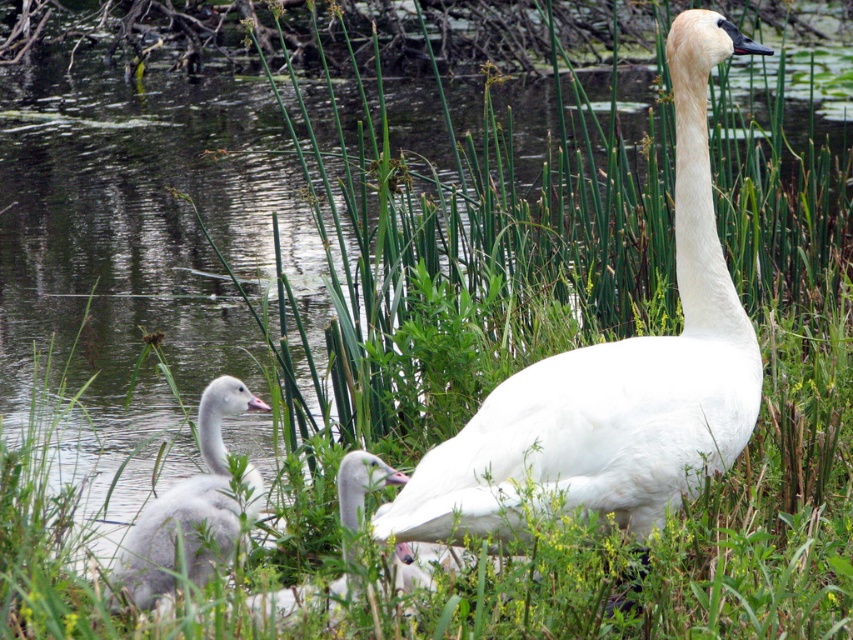
You are a wildlife photographer trying to capture a photo of the gray downy swan at lower left and the white matte duckling at center. You want to ensure both subjects are in focus. Since depth of field is limited, you need to adjust your camera settings based on their sizes. Which subject should you focus on to ensure the larger one is sharp?

The gray downy swan at lower left has a greater height compared to the white matte duckling at center. To ensure the larger subject is sharp, focus on the gray downy swan at lower left.

You are a wildlife photographer aiming to capture a photo of the white feathered swan at center and the gray downy swan at lower left. Since you want to emphasize the size difference between them, which swan should you focus on to highlight its larger size?

The white feathered swan at center has a greater height compared to the gray downy swan at lower left, so focusing on the white feathered swan at center will emphasize its larger size.

You are a wildlife photographer aiming to capture a closeup shot of both the white feathered swan at center and the white matte duckling at center. Your camera has a maximum focus range of 15 inches. Can you photograph both subjects without moving your camera position?

The distance between the white feathered swan at center and the white matte duckling at center is 16.40 inches, which exceeds the camera maximum focus range of 15 inches. Therefore, you cannot photograph both subjects without moving the camera position.